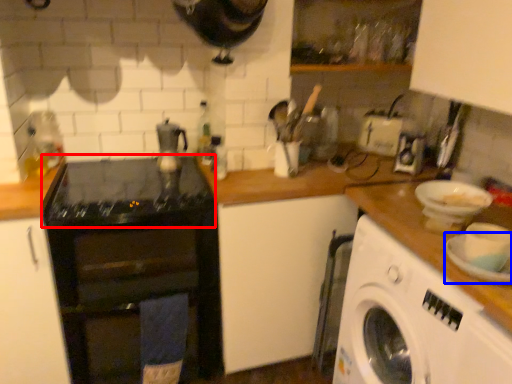
Question: Which object appears farthest to the camera in this image, gas stove (highlighted by a red box) or plate (highlighted by a blue box)?

Choices:
 (A) gas stove
 (B) plate

Answer: (A)